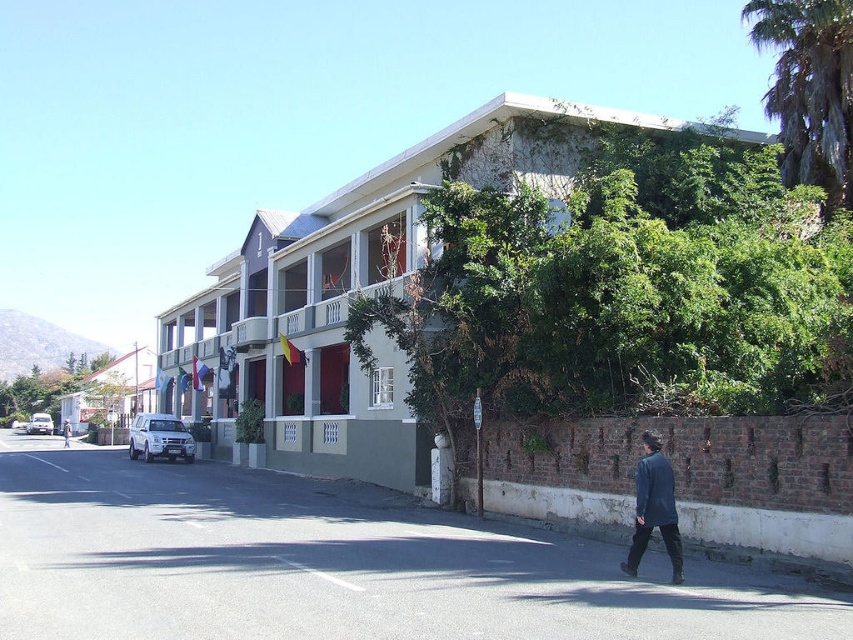
Does green leafy palm tree at upper right have a smaller size compared to dark blue fabric coat at lower right?

No, green leafy palm tree at upper right is not smaller than dark blue fabric coat at lower right.

Does green leafy palm tree at upper right appear on the left side of dark blue fabric coat at lower right?

Incorrect, green leafy palm tree at upper right is not on the left side of dark blue fabric coat at lower right.

Who is more distant from viewer, (x=808, y=22) or (x=660, y=456)?

The point (x=808, y=22) is more distant.

Find the location of a particular element. This screenshot has width=853, height=640. green leafy palm tree at upper right is located at coordinates (809, 88).

Between green leafy palm tree at upper right and light blue denim jacket at lower right, which one has less height?

Standing shorter between the two is light blue denim jacket at lower right.

Consider the image. Is green leafy palm tree at upper right above light blue denim jacket at lower right?

Correct, green leafy palm tree at upper right is located above light blue denim jacket at lower right.

Consider the image. Measure the distance between point [798,24] and camera.

Point [798,24] is 77.88 feet from camera.

The width and height of the screenshot is (853, 640). Find the location of `green leafy palm tree at upper right`. green leafy palm tree at upper right is located at coordinates click(809, 88).

Which is more to the left, dark blue fabric coat at lower right or light blue denim jacket at lower right?

Positioned to the left is light blue denim jacket at lower right.

Find the location of a particular element. The width and height of the screenshot is (853, 640). dark blue fabric coat at lower right is located at coordinates (654, 508).